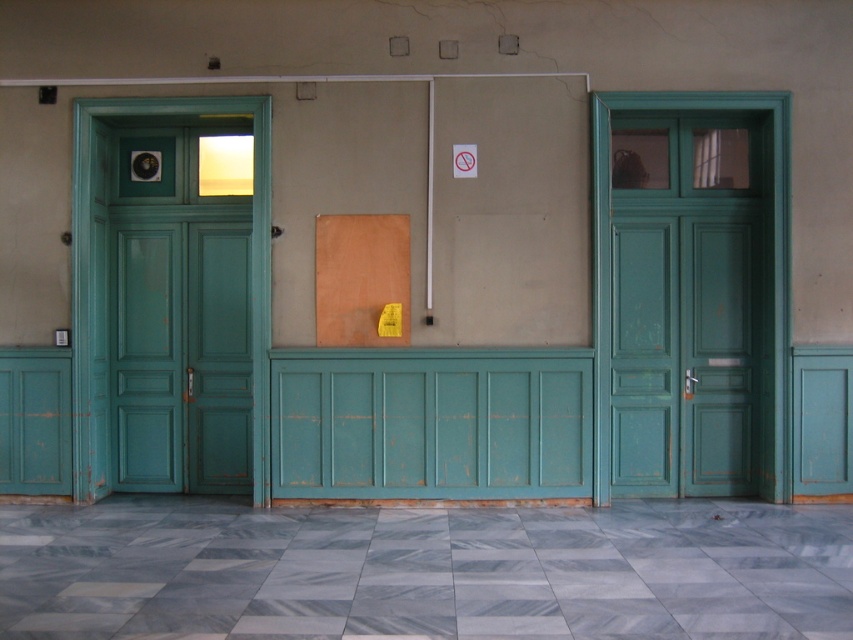
You are standing in front of the teal doors and notice two points marked on the wall. Which point, point [640,337] or point [236,262], is closer to you?

Point [640,337] is closer to the viewer than point [236,262].

In the scene shown: You are an interior designer planning to install a new decorative shelf between the teal wooden door at right and the teal wooden door at left. Given their sizes, which door should the shelf be placed closer to for better visual balance?

The teal wooden door at right is larger in size than the teal wooden door at left, so the shelf should be placed closer to the teal wooden door at left to balance the visual weight.

You are standing in a hallway and see two teal wooden doors. The teal wooden door at right and the teal wooden door at left. Which door is closer to you?

The teal wooden door at right is closer to you because it is in front of the teal wooden door at left.